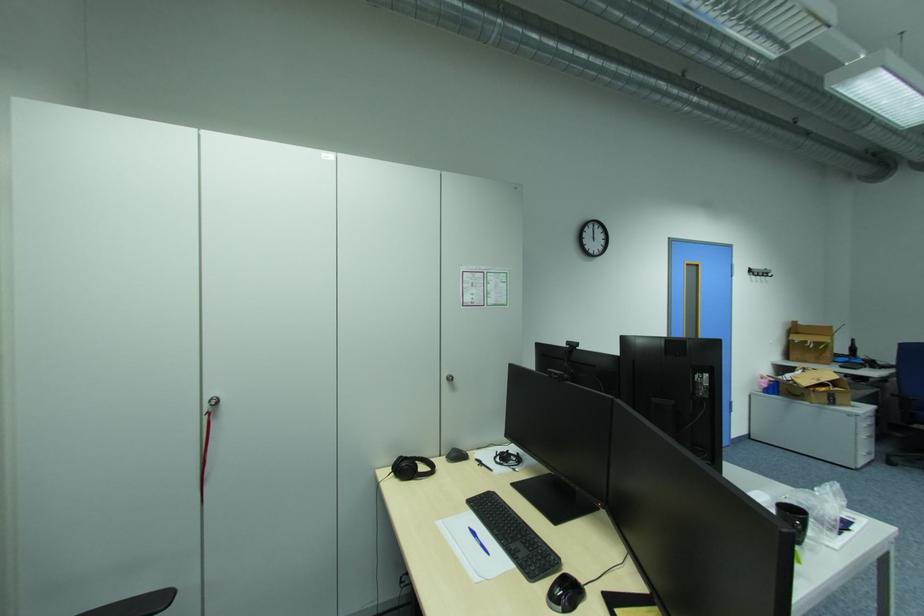
Where would you lift the dark glass bottle? Please return your answer as a coordinate pair (x, y).

(852, 347)